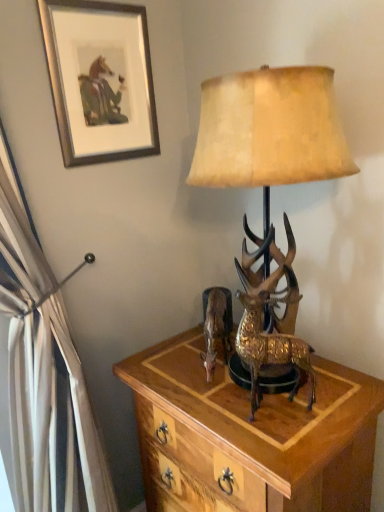
This screenshot has height=512, width=384. Find the location of `vacant area that is situated to the right of gold textured deer at center`. vacant area that is situated to the right of gold textured deer at center is located at coordinates (334, 399).